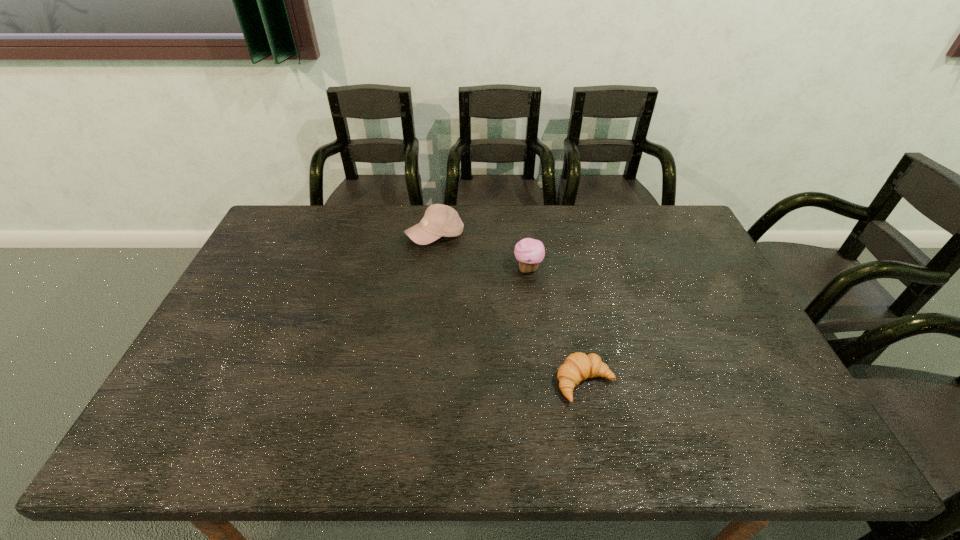
Find the location of a particular element. The width and height of the screenshot is (960, 540). vacant area between the farthest object and the cupcake is located at coordinates (482, 252).

The width and height of the screenshot is (960, 540). I want to click on empty space that is in between the farthest object and the crescent roll, so click(x=511, y=309).

This screenshot has width=960, height=540. Find the location of `empty space that is in between the baseball cap and the shortest object`. empty space that is in between the baseball cap and the shortest object is located at coordinates (511, 309).

Image resolution: width=960 pixels, height=540 pixels. What are the coordinates of `object that is the second closest to the farthest object` in the screenshot? It's located at (x=578, y=366).

Where is `the second closest object relative to the cupcake`? This screenshot has height=540, width=960. the second closest object relative to the cupcake is located at coordinates (578, 366).

Identify the location of free spot that satisfies the following two spatial constraints: 1. on the front-facing side of the second farthest object; 2. on the left side of the leftmost object. The image size is (960, 540). (431, 269).

At what (x,y) coordinates should I click in order to perform the action: click on vacant point that satisfies the following two spatial constraints: 1. on the front-facing side of the leftmost object; 2. on the left side of the second farthest object. Please return your answer as a coordinate pair (x, y). This screenshot has width=960, height=540. Looking at the image, I should click on (431, 269).

You are a GUI agent. You are given a task and a screenshot of the screen. Output one action in this format:
    pyautogui.click(x=<x>, y=<y>)
    Task: Click on the free spot that satisfies the following two spatial constraints: 1. on the front-facing side of the baseball cap; 2. on the left side of the second farthest object
    The image size is (960, 540).
    Given the screenshot: What is the action you would take?
    pyautogui.click(x=431, y=269)

Locate an element on the screen. This screenshot has width=960, height=540. blank space that satisfies the following two spatial constraints: 1. on the front-facing side of the baseball cap; 2. on the right side of the second nearest object is located at coordinates (431, 269).

You are a GUI agent. You are given a task and a screenshot of the screen. Output one action in this format:
    pyautogui.click(x=<x>, y=<y>)
    Task: Click on the vacant position in the image that satisfies the following two spatial constraints: 1. on the front-facing side of the leftmost object; 2. on the left side of the cupcake
    
    Given the screenshot: What is the action you would take?
    pyautogui.click(x=431, y=269)